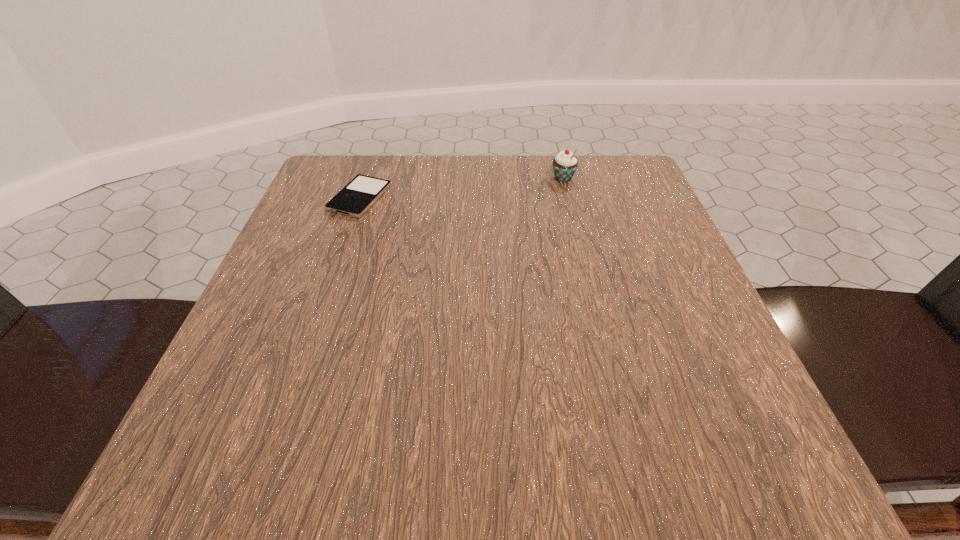
This screenshot has height=540, width=960. I want to click on the right object, so click(x=564, y=164).

The height and width of the screenshot is (540, 960). What are the coordinates of `cupcake` in the screenshot? It's located at (564, 164).

The height and width of the screenshot is (540, 960). I want to click on the left object, so click(363, 191).

The width and height of the screenshot is (960, 540). What are the coordinates of `the shorter object` in the screenshot? It's located at (363, 191).

At what (x,y) coordinates should I click in order to perform the action: click on vacant area located on the right of the right object. Please return your answer as a coordinate pair (x, y). The image size is (960, 540). Looking at the image, I should click on (625, 178).

Find the location of a particular element. The height and width of the screenshot is (540, 960). vacant space located on the right of the shorter object is located at coordinates (430, 198).

Locate an element on the screen. The width and height of the screenshot is (960, 540). cupcake at the far edge is located at coordinates (564, 164).

Locate an element on the screen. Image resolution: width=960 pixels, height=540 pixels. iPod that is at the far edge is located at coordinates (363, 191).

This screenshot has height=540, width=960. In order to click on object present at the left edge in this screenshot , I will do `click(363, 191)`.

I want to click on object situated at the right edge, so click(x=564, y=164).